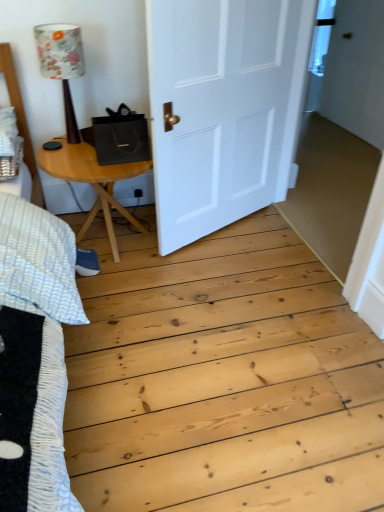
You are a GUI agent. You are given a task and a screenshot of the screen. Output one action in this format:
    pyautogui.click(x=<x>, y=<y>)
    Task: Click on the free spot in front of floral fabric lampshade at upper left
    This screenshot has width=384, height=512.
    Given the screenshot: What is the action you would take?
    pyautogui.click(x=68, y=158)